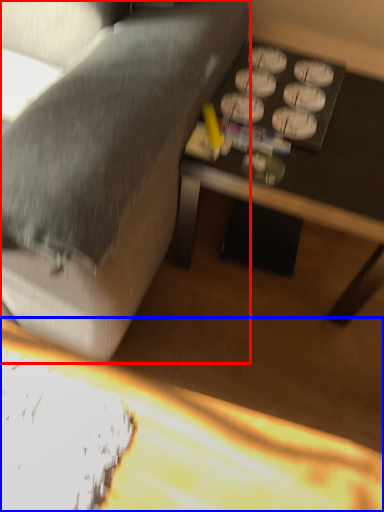
Question: Which object is closer to the camera taking this photo, studio couch (highlighted by a red box) or table (highlighted by a blue box)?

Choices:
 (A) studio couch
 (B) table

Answer: (A)